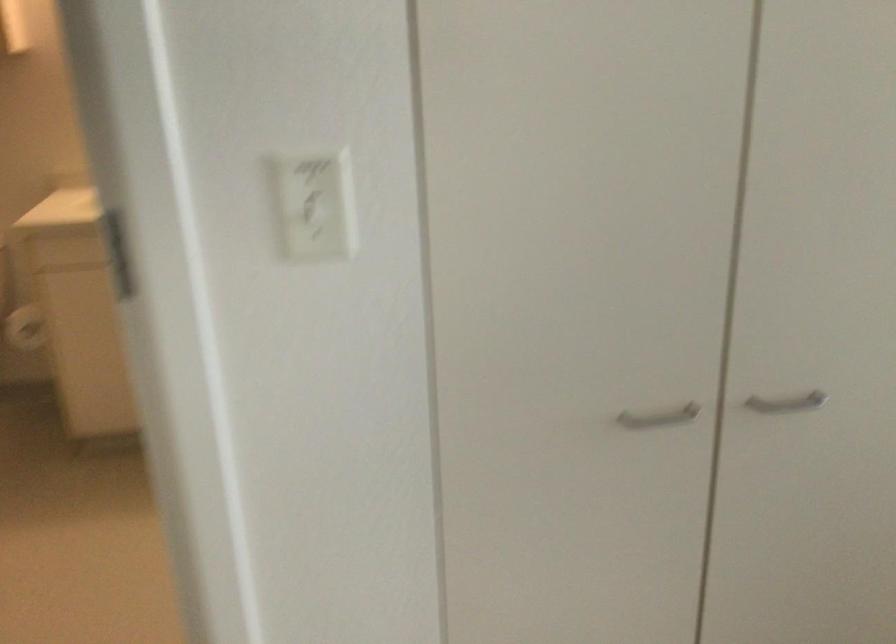
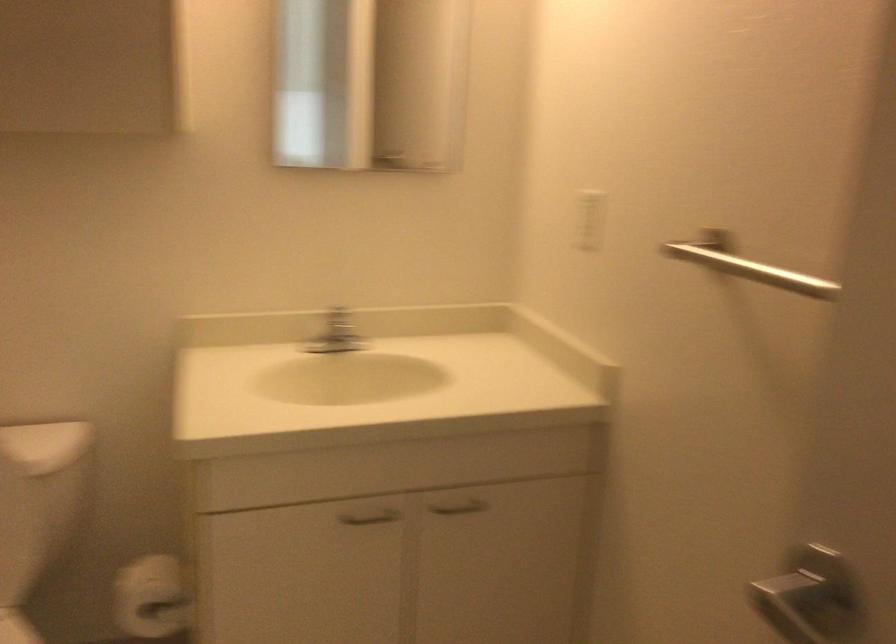
What movement of the cameraman would produce the second image?

The cameraman moved toward left, forward.